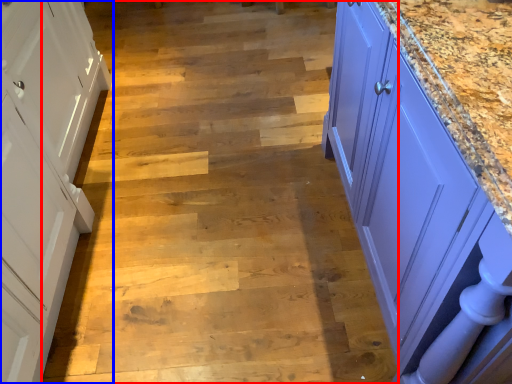
Question: Which point is further to the camera, stair (highlighted by a red box) or cabinetry (highlighted by a blue box)?

Choices:
 (A) stair
 (B) cabinetry

Answer: (A)